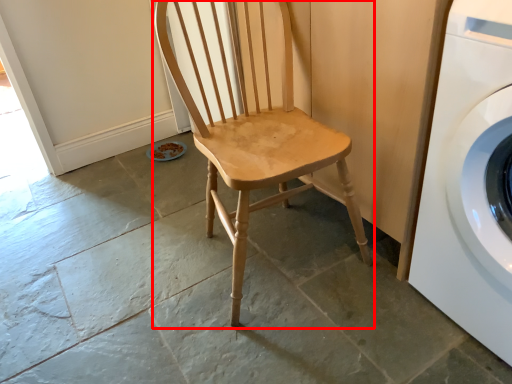
Question: Where is chair (annotated by the red box) located in relation to washing machine in the image?

Choices:
 (A) right
 (B) left

Answer: (B)